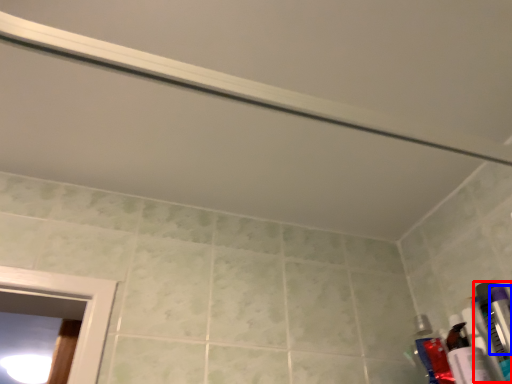
Question: Among these objects, which one is nearest to the camera, toiletry (highlighted by a red box) or toiletry (highlighted by a blue box)?

Choices:
 (A) toiletry
 (B) toiletry

Answer: (B)